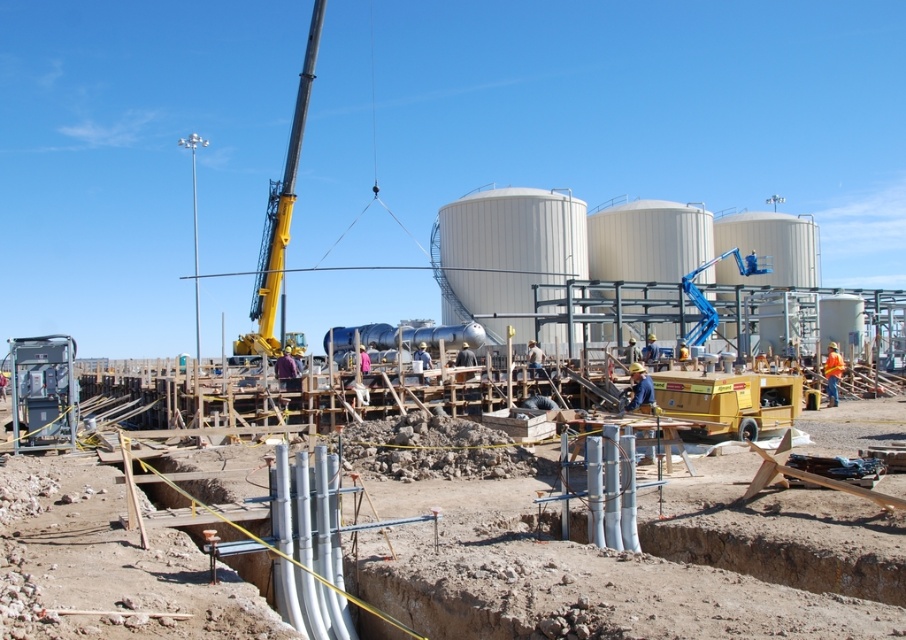
Can you confirm if white concrete pipes at center is bigger than yellow metallic crane at upper left?

No, white concrete pipes at center is not bigger than yellow metallic crane at upper left.

Between point (85, 474) and point (268, 230), which one is positioned in front?

Point (85, 474) is more forward.

This screenshot has height=640, width=906. Find the location of `white concrete pipes at center`. white concrete pipes at center is located at coordinates (567, 580).

Does yellow metallic crane at upper left appear under metallic gray generator at lower left?

Incorrect, yellow metallic crane at upper left is not positioned below metallic gray generator at lower left.

Does point (296, 116) lie behind point (16, 339)?

Yes.

The height and width of the screenshot is (640, 906). In order to click on yellow metallic crane at upper left in this screenshot , I will do `click(280, 212)`.

Between white concrete pipes at center and metallic gray generator at lower left, which one has less height?

With less height is white concrete pipes at center.

Is point (437, 600) farther from camera compared to point (46, 365)?

No, it is not.

I want to click on white concrete pipes at center, so click(567, 580).